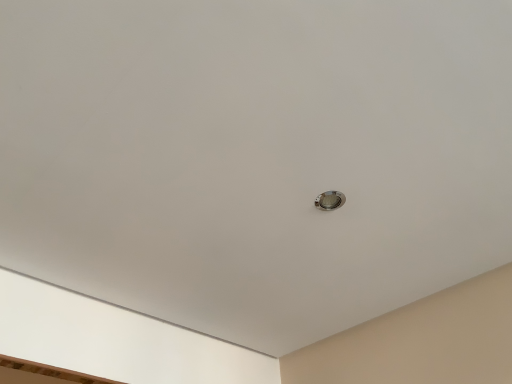
Locate an element on the screen. Image resolution: width=512 pixels, height=384 pixels. satin silver light at center is located at coordinates (330, 200).

Image resolution: width=512 pixels, height=384 pixels. Describe the element at coordinates (330, 200) in the screenshot. I see `satin silver light at center` at that location.

The height and width of the screenshot is (384, 512). In order to click on satin silver light at center in this screenshot , I will do pos(330,200).